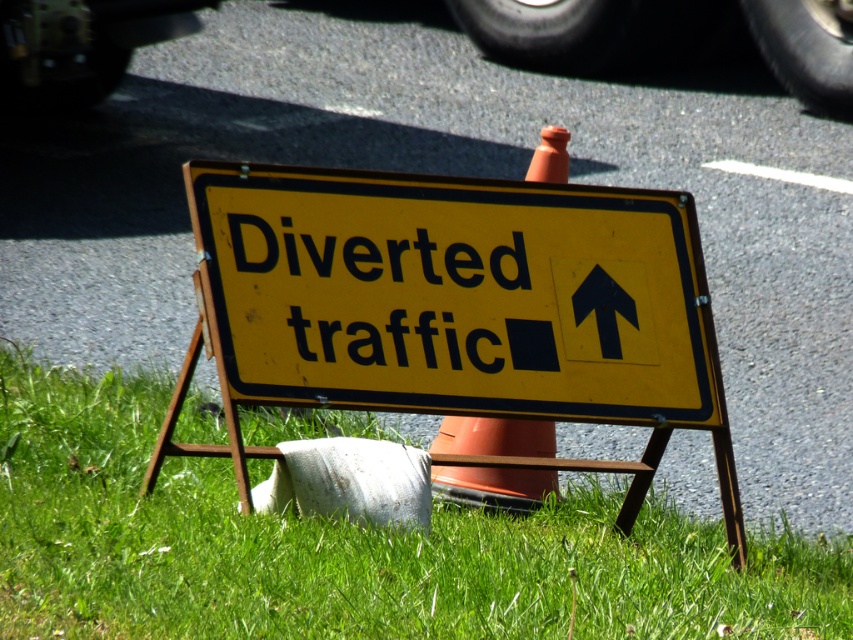
Question: Which point is closer to the camera?

Choices:
 (A) green grass at lower left
 (B) yellow matte sign at center

Answer: (A)

Question: From the image, what is the correct spatial relationship of green grass at lower left in relation to black rubber tire at upper center?

Choices:
 (A) above
 (B) below

Answer: (B)

Question: Which object appears farthest from the camera in this image?

Choices:
 (A) orange plastic traffic cone at center
 (B) black rubber tire at upper center
 (C) green grass at lower left

Answer: (B)

Question: Which object appears farthest from the camera in this image?

Choices:
 (A) black rubber tire at upper center
 (B) yellow matte sign at center
 (C) green grass at lower left
 (D) orange plastic traffic cone at center

Answer: (A)

Question: Can you confirm if green grass at lower left is positioned to the left of black rubber tire at upper center?

Choices:
 (A) no
 (B) yes

Answer: (B)

Question: Is black rubber tire at upper center to the left of orange plastic traffic cone at center from the viewer's perspective?

Choices:
 (A) yes
 (B) no

Answer: (B)